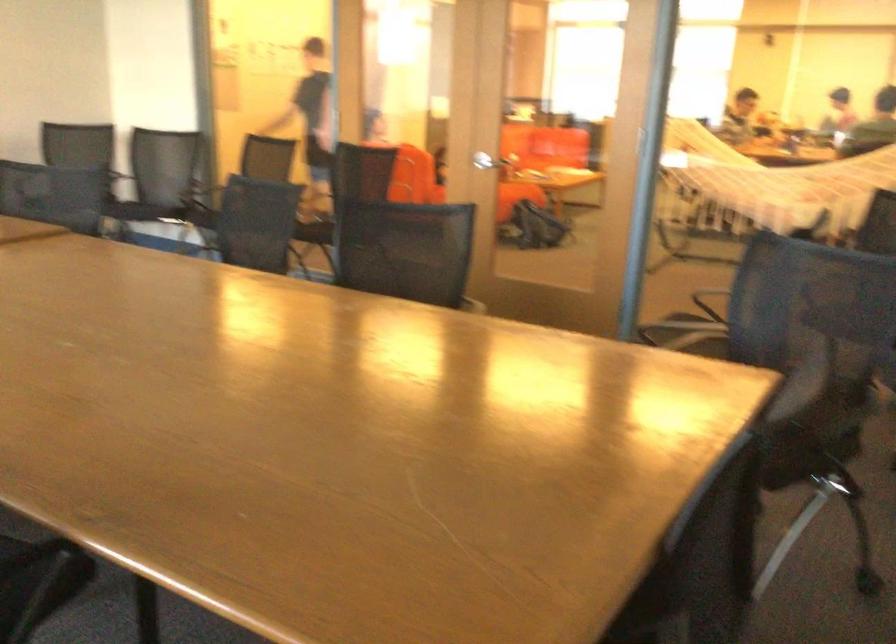
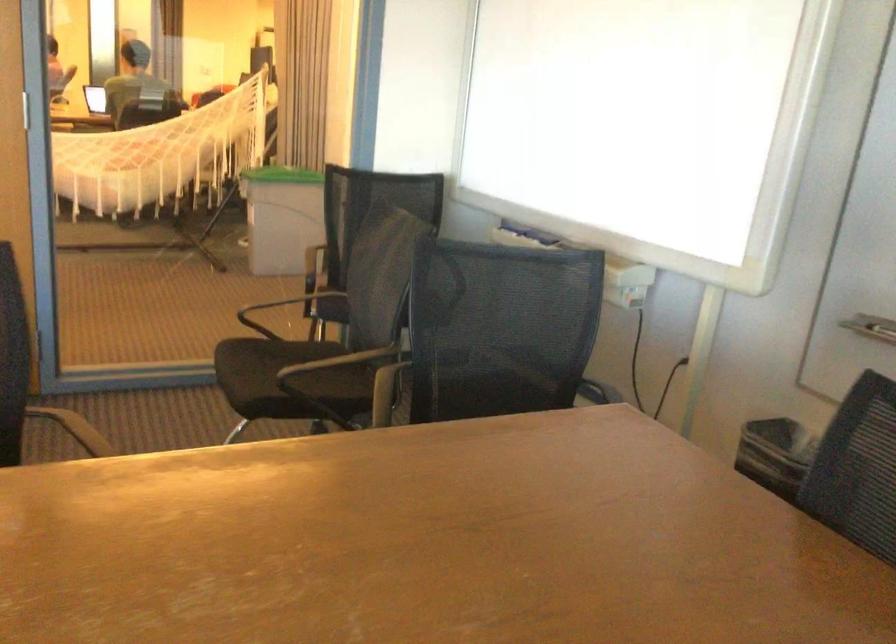
Question: I am providing you with two images of the same scene from different viewpoints. After the viewpoint changes to image2, which objects are now occluded?

Choices:
 (A) textured stand grip
 (B) black chair armrest
 (C) chair sitting surface
 (D) green trash can lid

Answer: (C)